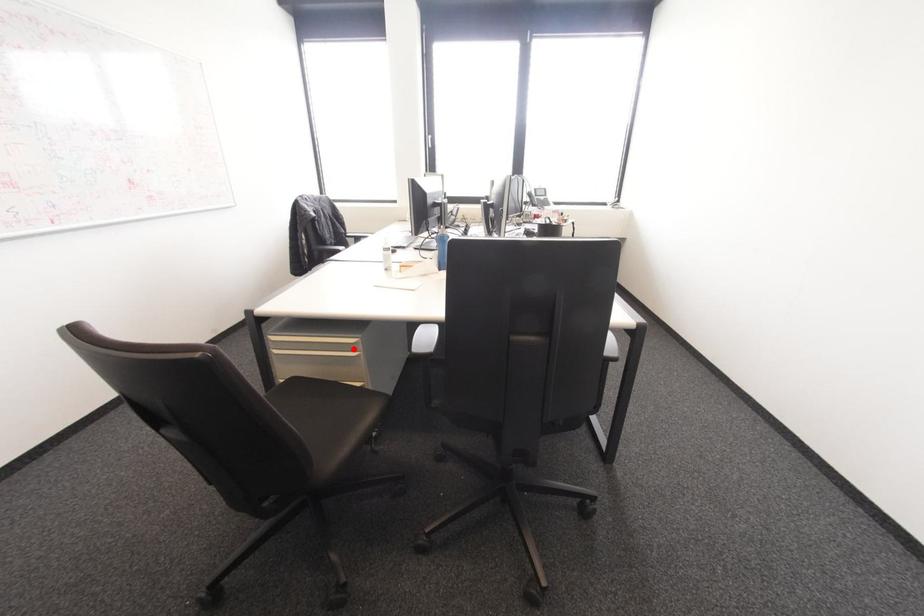
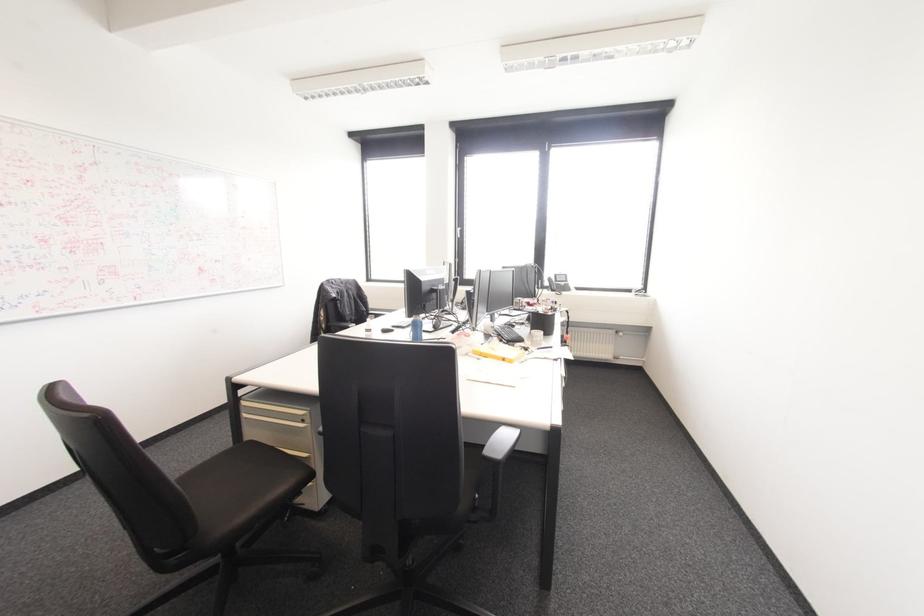
Find the pixel in the second image that matches the highlighted location in the first image.

(302, 419)